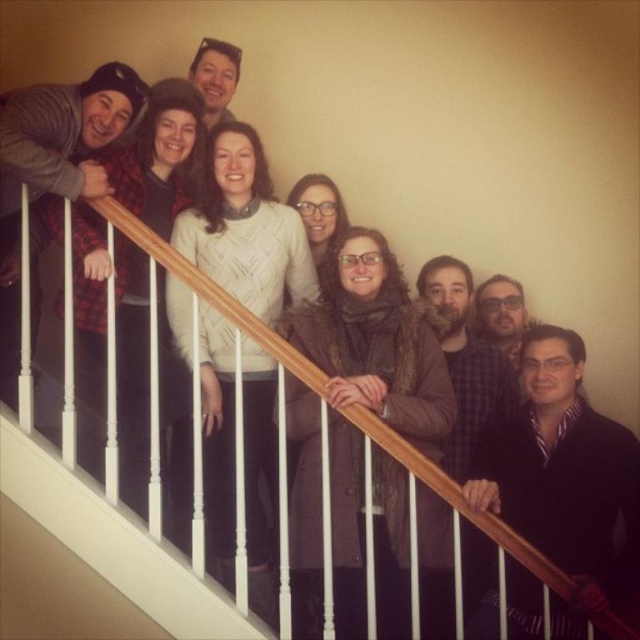
You are standing on the staircase and want to grab the white knitted sweater at center. Is the wooden handrail at center in your way?

The wooden handrail at center is located below the white knitted sweater at center, so it is not blocking your path to the sweater.

You are organizing a clothing donation drive and need to determine which of the two items takes up more space in a donation bin. Based on the image, which item is wider between the brown fuzzy coat at center and the white knitted sweater at center?

The brown fuzzy coat at center is wider than the white knitted sweater at center, so it takes up more space in the donation bin.